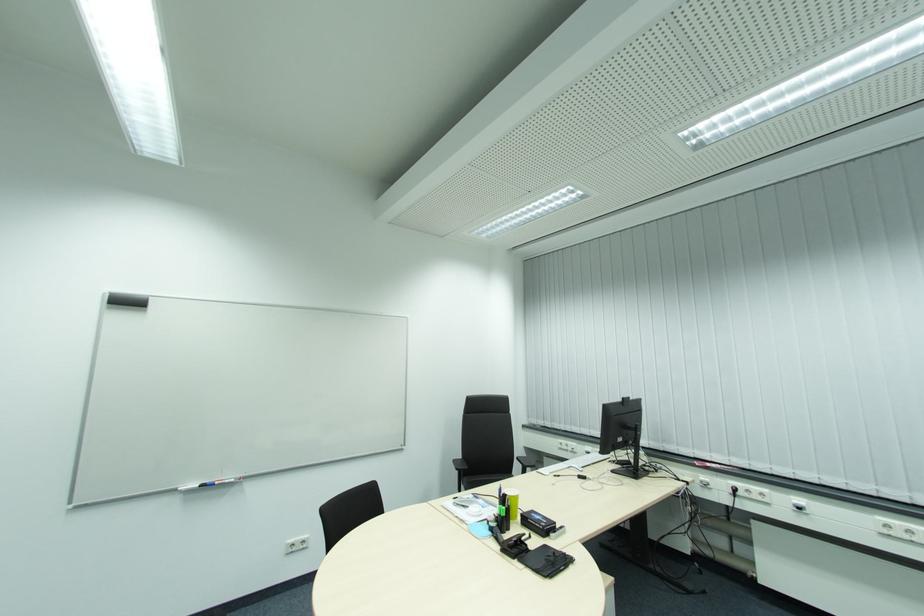
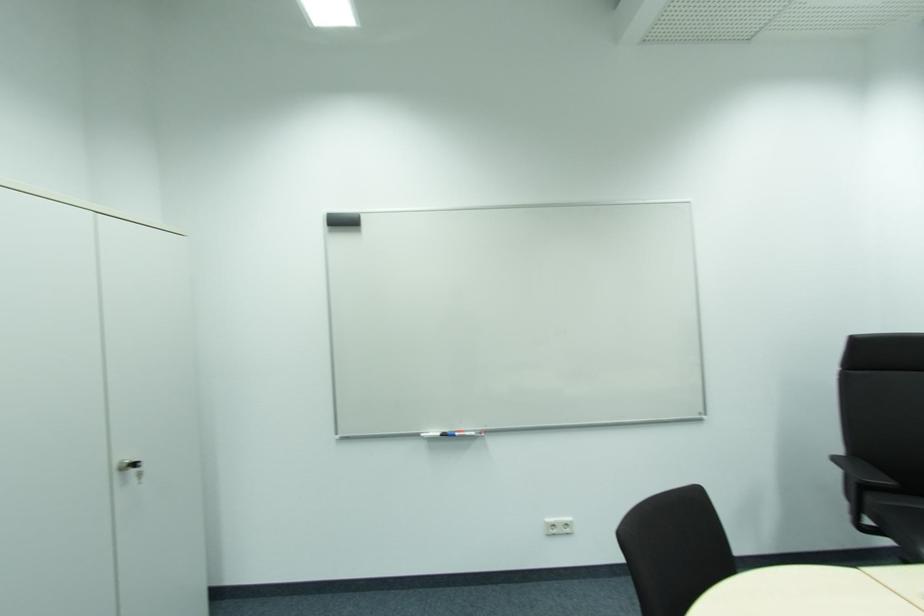
The point at [310,541] is marked in the first image. Where is the corresponding point in the second image?

(572, 524)